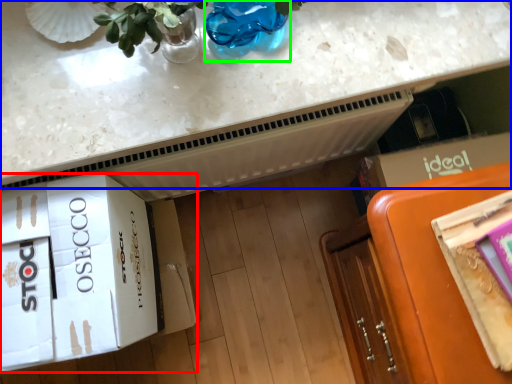
Question: Estimate the real-world distances between objects in this image. Which object is closer to cardboard box (highlighted by a red box), countertop (highlighted by a blue box) or glass vase (highlighted by a green box)?

Choices:
 (A) countertop
 (B) glass vase

Answer: (A)